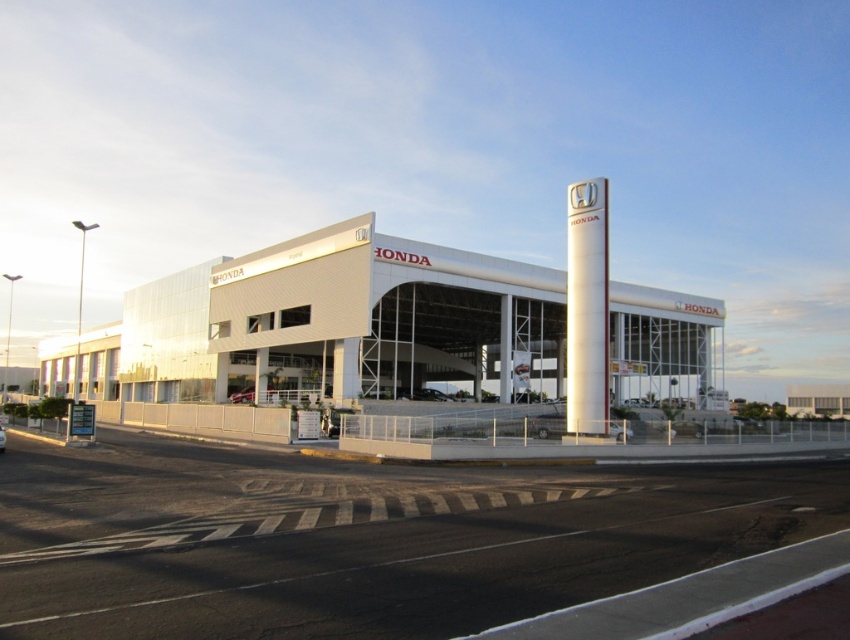
Does white matte building at center appear on the right side of white glossy pillar at center?

Incorrect, white matte building at center is not on the right side of white glossy pillar at center.

In the scene shown: Which is above, white matte building at center or white glossy pillar at center?

white glossy pillar at center is above.

Which is in front, point (420, 346) or point (502, 339)?

Point (502, 339) is in front.

In order to click on white matte building at center in this screenshot , I will do `click(323, 324)`.

Where is `white glossy pillar at center`? The image size is (850, 640). white glossy pillar at center is located at coordinates (505, 348).

Between white glossy pillar at center and metallic silver sedan at center, which one has more height?

white glossy pillar at center

Which is in front, point (505, 388) or point (3, 432)?

Point (3, 432)

Locate an element on the screen. This screenshot has width=850, height=640. white glossy pillar at center is located at coordinates (505, 348).

Is white matte building at center to the left of metallic silver sedan at center from the viewer's perspective?

Indeed, white matte building at center is positioned on the left side of metallic silver sedan at center.

Where is `white matte building at center`? The width and height of the screenshot is (850, 640). white matte building at center is located at coordinates (323, 324).

What do you see at coordinates (323, 324) in the screenshot? I see `white matte building at center` at bounding box center [323, 324].

At what (x,y) coordinates should I click in order to perform the action: click on white matte building at center. Please return your answer as a coordinate pair (x, y). The image size is (850, 640). Looking at the image, I should click on 323,324.